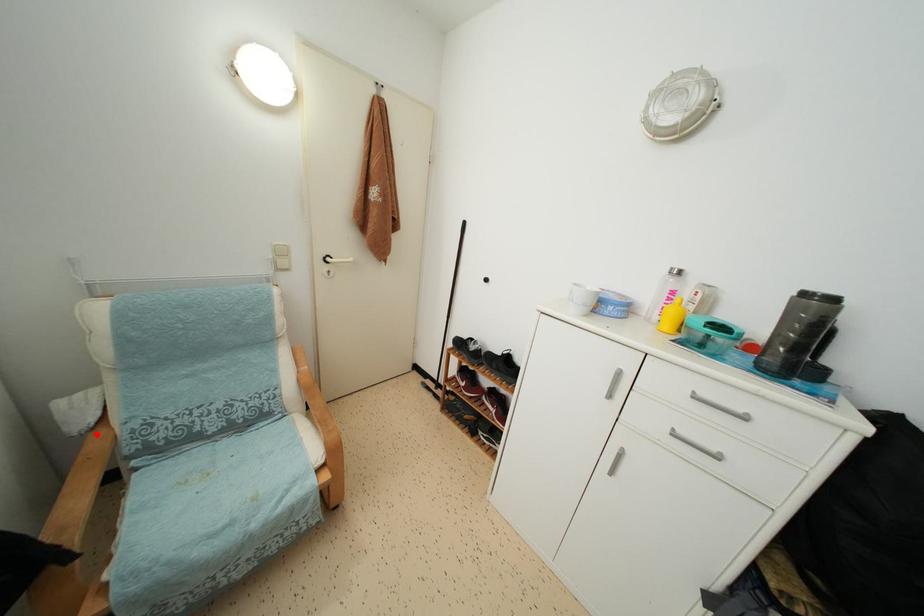
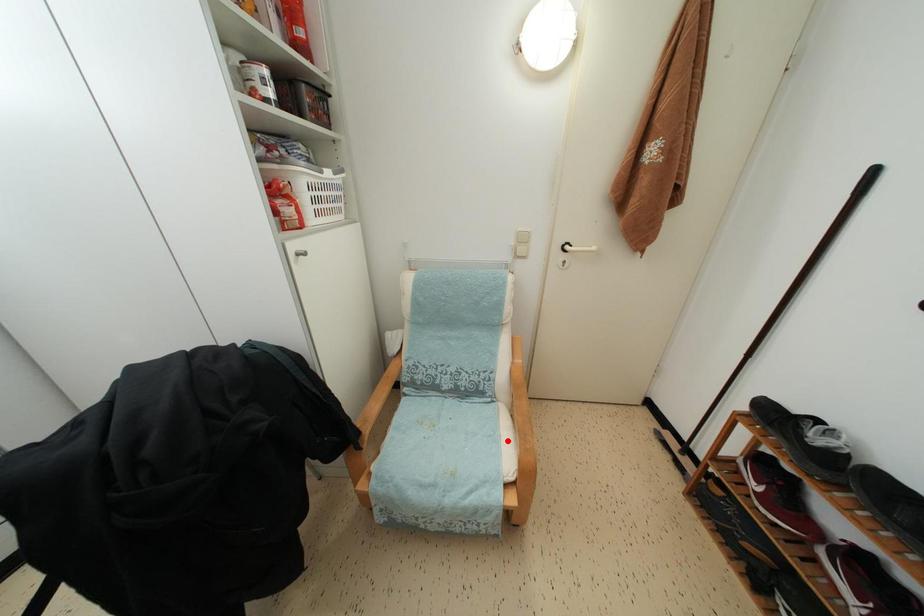
I am providing you with two images of the same scene from different viewpoints. A red point is marked on the first image and another point is marked on the second image. Do the highlighted points in image1 and image2 indicate the same real-world spot?

No